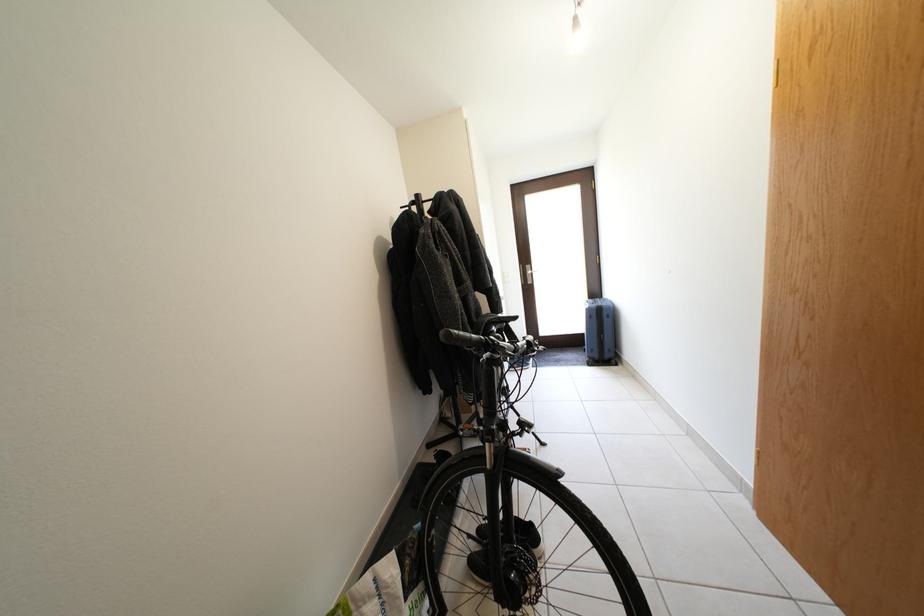
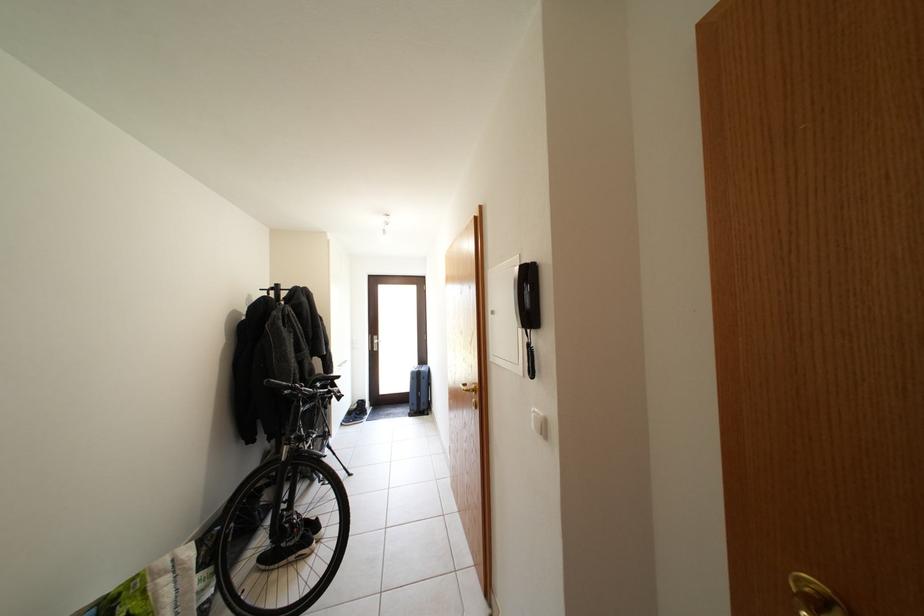
Locate, in the second image, the point that corresponds to (x=420, y=209) in the first image.

(281, 294)